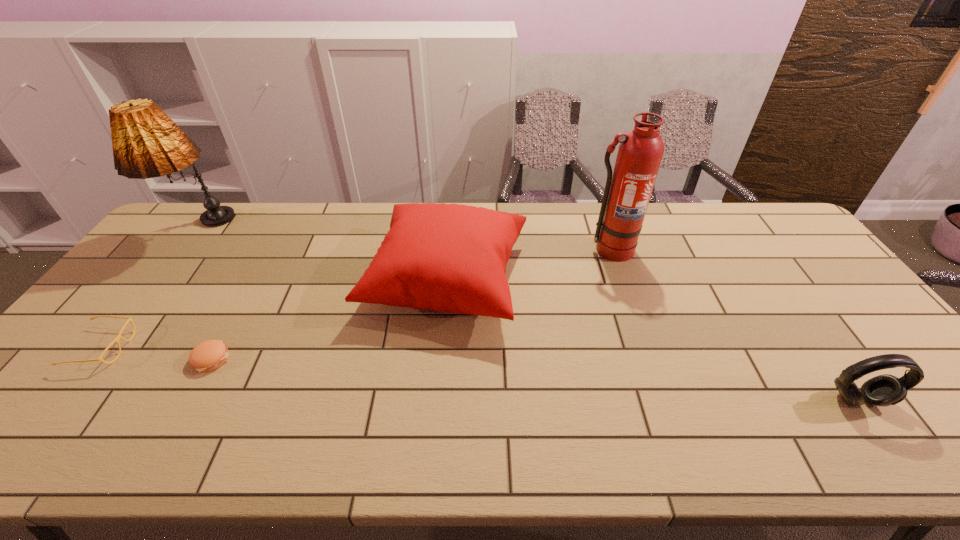
At what (x,y) coordinates should I click in order to perform the action: click on lampshade. Please return your answer as a coordinate pair (x, y). This screenshot has height=540, width=960. Looking at the image, I should click on [x=146, y=143].

Locate an element on the screen. fire extinguisher is located at coordinates (627, 193).

Find the location of `the fourth object from left to right`. the fourth object from left to right is located at coordinates (451, 258).

Locate an element on the screen. the fourth shortest object is located at coordinates (451, 258).

Find the location of a particular element. the rightmost object is located at coordinates (884, 390).

The height and width of the screenshot is (540, 960). What are the coordinates of `headset` in the screenshot? It's located at (884, 390).

You are a GUI agent. You are given a task and a screenshot of the screen. Output one action in this format:
    pyautogui.click(x=<x>, y=<y>)
    Task: Click on the spectacles
    The height and width of the screenshot is (540, 960).
    Given the screenshot: What is the action you would take?
    pyautogui.click(x=119, y=336)

I want to click on patty, so click(209, 355).

You are a GUI agent. You are given a task and a screenshot of the screen. Output one action in this format:
    pyautogui.click(x=<x>, y=<y>)
    Task: Click on the free space located on the front-facing side of the lampshade
    
    Given the screenshot: What is the action you would take?
    pyautogui.click(x=119, y=340)

Locate an element on the screen. Image resolution: width=960 pixels, height=540 pixels. vacant region located 0.050m on the label side of the second object from right to left is located at coordinates (617, 273).